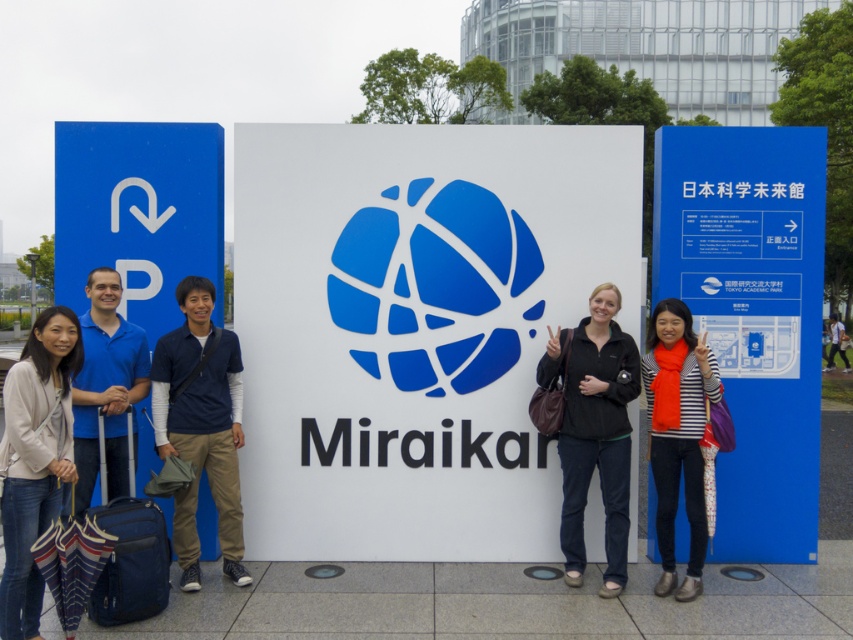
Can you confirm if blue matte logo at center is wider than blue cotton shirt at center?

Yes.

This screenshot has width=853, height=640. Identify the location of blue matte logo at center. (434, 285).

Between blue cotton shirt at center and black fabric jacket at center, which one appears on the right side from the viewer's perspective?

black fabric jacket at center is more to the right.

Which of these two, blue cotton shirt at center or black fabric jacket at center, stands shorter?

With less height is black fabric jacket at center.

Is point (219, 368) more distant than point (833, 344)?

No, (219, 368) is in front of (833, 344).

What are the coordinates of `blue cotton shirt at center` in the screenshot? It's located at (200, 426).

Who is more forward, [776,358] or [210,308]?

Positioned in front is point [210,308].

Is blue plastic sign at right to the right of blue cotton shirt at center from the viewer's perspective?

Correct, you'll find blue plastic sign at right to the right of blue cotton shirt at center.

The image size is (853, 640). Describe the element at coordinates (752, 314) in the screenshot. I see `blue plastic sign at right` at that location.

Locate an element on the screen. The width and height of the screenshot is (853, 640). blue plastic sign at right is located at coordinates (752, 314).